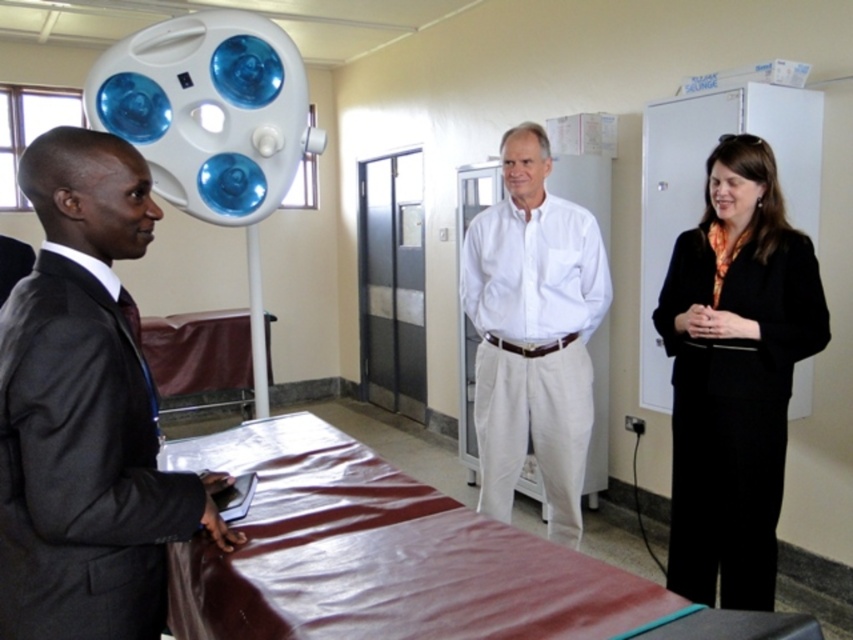
Question: Does black smooth suit at right appear on the left side of white cotton shirt at center?

Choices:
 (A) yes
 (B) no

Answer: (B)

Question: Considering the relative positions of black smooth suit at right and white cotton shirt at center in the image provided, where is black smooth suit at right located with respect to white cotton shirt at center?

Choices:
 (A) below
 (B) above

Answer: (A)

Question: Which of the following is the closest to the observer?

Choices:
 (A) dark gray suit at center
 (B) white cotton shirt at center

Answer: (A)

Question: Does dark gray suit at center have a lesser width compared to black smooth suit at right?

Choices:
 (A) yes
 (B) no

Answer: (A)

Question: Which point is farther to the camera?

Choices:
 (A) black smooth suit at right
 (B) dark gray suit at center

Answer: (A)

Question: Estimate the real-world distances between objects in this image. Which object is closer to the black smooth suit at right?

Choices:
 (A) white cotton shirt at center
 (B) dark gray suit at center

Answer: (A)